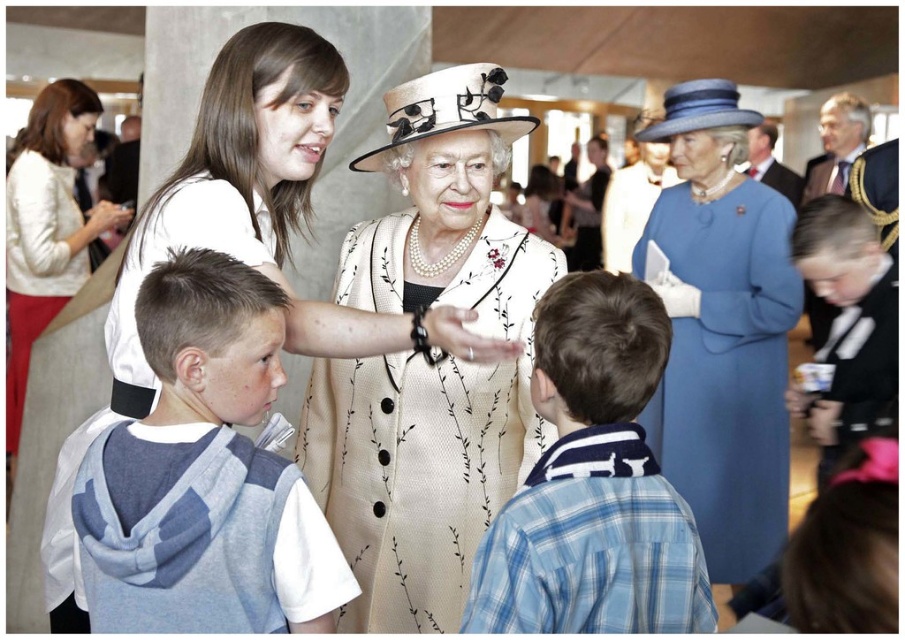
Does blue plaid shirt at center appear over matte white dress at center?

No.

Is blue plaid shirt at center taller than matte white dress at center?

No.

Who is more forward, (597, 618) or (424, 337)?

Point (597, 618) is in front.

At what (x,y) coordinates should I click in order to perform the action: click on blue plaid shirt at center. Please return your answer as a coordinate pair (x, y). This screenshot has width=905, height=640. Looking at the image, I should click on (593, 483).

Is gray cotton hoodie at center shorter than white textured sweater at upper left?

Yes.

Is gray cotton hoodie at center taller than white textured sweater at upper left?

Incorrect, gray cotton hoodie at center's height is not larger of white textured sweater at upper left's.

Where is `gray cotton hoodie at center`? The width and height of the screenshot is (905, 640). gray cotton hoodie at center is located at coordinates (205, 474).

Where is `gray cotton hoodie at center`? gray cotton hoodie at center is located at coordinates (205, 474).

Does matte white dress at center have a lesser width compared to blue woolen dress at center?

Incorrect, matte white dress at center's width is not less than blue woolen dress at center's.

Is point (296, 209) positioned before point (738, 291)?

Yes, point (296, 209) is closer to viewer.

Locate an element on the screen. The height and width of the screenshot is (640, 905). matte white dress at center is located at coordinates (241, 244).